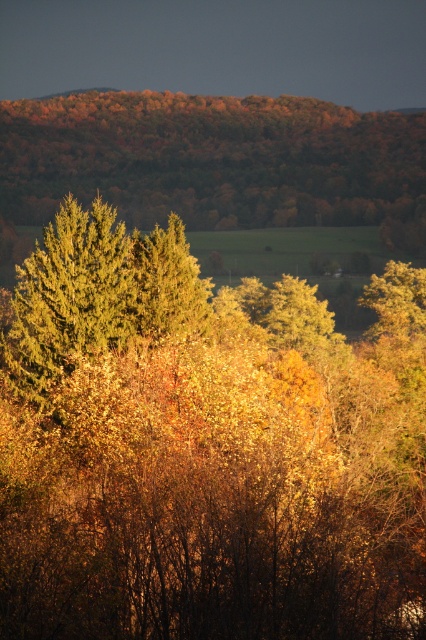
Question: Which object is closer to the camera taking this photo?

Choices:
 (A) green matte tree at center
 (B) green matte tree at upper center

Answer: (A)

Question: Which object appears farthest from the camera in this image?

Choices:
 (A) green matte tree at center
 (B) green matte tree at upper center

Answer: (B)

Question: Does green matte tree at upper center have a greater width compared to green matte tree at center?

Choices:
 (A) yes
 (B) no

Answer: (A)

Question: In this image, where is green matte tree at upper center located relative to green matte tree at center?

Choices:
 (A) left
 (B) right

Answer: (B)

Question: Is green matte tree at upper center bigger than green matte tree at center?

Choices:
 (A) no
 (B) yes

Answer: (B)